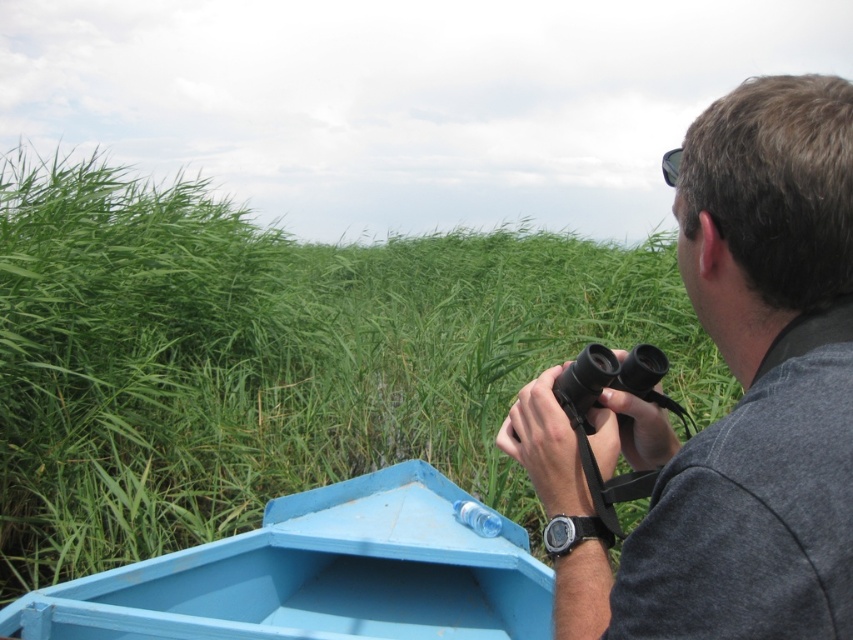
You are a photographer trying to capture the green grass at center and the light blue painted wood boat at lower left in the same frame. Which object should you focus on first to ensure both are in focus?

You should focus on the green grass at center first because it is closer to the viewer than the light blue painted wood boat at lower left, so adjusting focus from near to far will help both be in focus.

You are in a boat and need to navigate through the reeds. You see two points marked on your map. The first point is at point (x=735, y=588) and the second point is at point (x=132, y=580). Which point is closer to your current position in the boat?

Point (x=735, y=588) is in front of point (x=132, y=580), so it is closer to your current position in the boat.

You are a wildlife photographer trying to capture a clear shot of the reeds in the background. You have a camera with a zoom lens and are standing on the gray fabric shirt at upper right. Can you see the green grass at center clearly without any obstruction?

The green grass at center is taller than gray fabric shirt at upper right, so the green grass at center would block your view of the reeds in the background when standing on the gray fabric shirt at upper right.